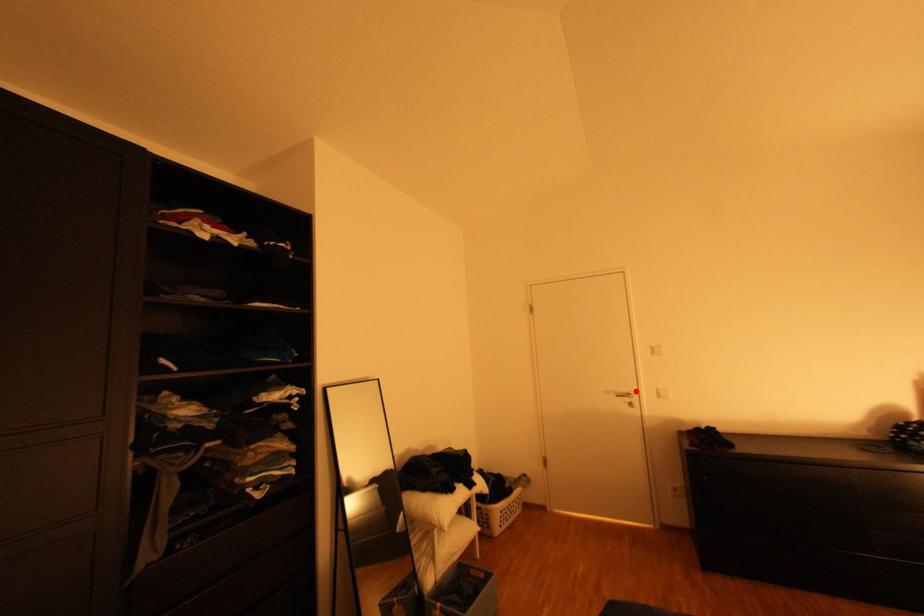
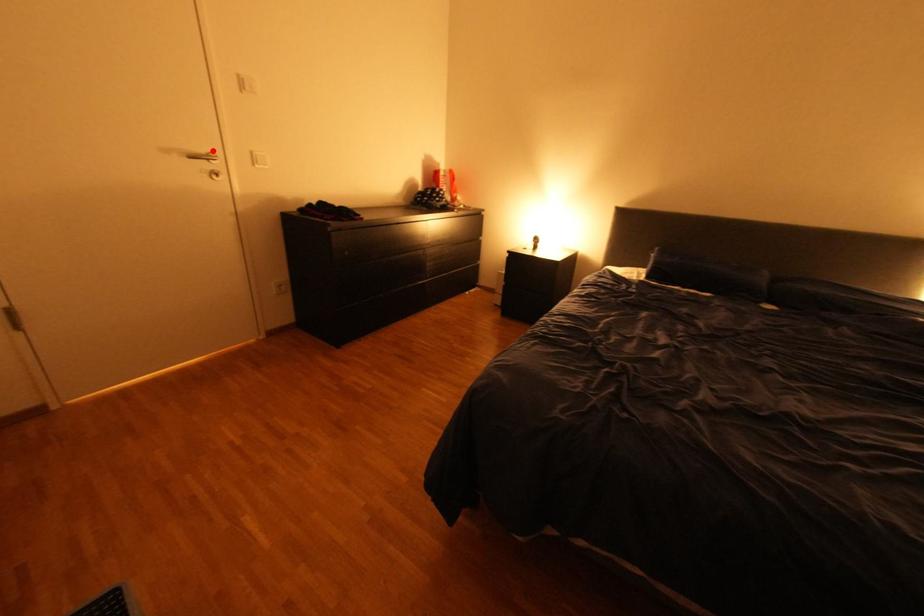
I am providing you with two images of the same scene from different viewpoints. A red point is marked on the first image and another point is marked on the second image. Is the marked point in image1 the same physical position as the marked point in image2?

Yes